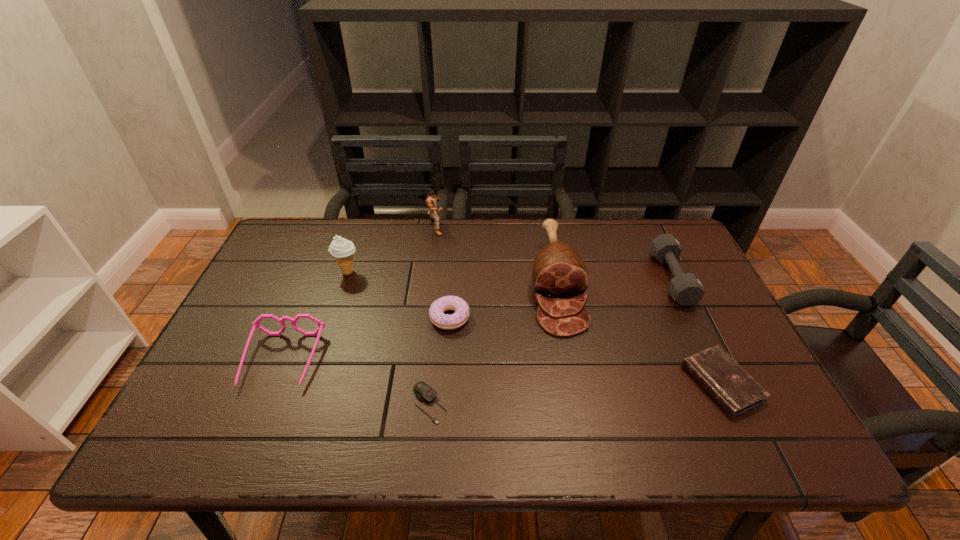
Where is `puncher`? The height and width of the screenshot is (540, 960). puncher is located at coordinates (431, 200).

At what (x,y) coordinates should I click in order to perform the action: click on ham. Please return your answer as a coordinate pair (x, y). Image resolution: width=960 pixels, height=540 pixels. Looking at the image, I should click on click(559, 272).

I want to click on icecream, so click(x=341, y=249).

The width and height of the screenshot is (960, 540). Find the location of `dumbbell`. dumbbell is located at coordinates (x=686, y=289).

The image size is (960, 540). Find the location of `spectacles`. spectacles is located at coordinates (256, 324).

The width and height of the screenshot is (960, 540). Identify the location of doughnut. (454, 303).

You are a GUI agent. You are given a task and a screenshot of the screen. Output one action in this format:
    pyautogui.click(x=<x>, y=<y>)
    Task: Click on the diary
    
    Given the screenshot: What is the action you would take?
    pyautogui.click(x=735, y=391)

Find the location of a particular element. The image size is (960, 540). mouse is located at coordinates (425, 393).

This screenshot has width=960, height=540. Find the location of `blank space located 0.250m on the front-facing side of the puncher`. blank space located 0.250m on the front-facing side of the puncher is located at coordinates (518, 227).

The width and height of the screenshot is (960, 540). In order to click on vacant space located at the sliced end of the sixth object from left to right in this screenshot , I will do `click(577, 400)`.